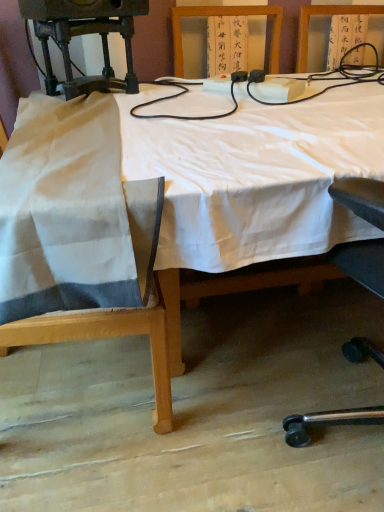
The height and width of the screenshot is (512, 384). Identify the location of white cloth-covered table at center. (252, 182).

What do you see at coordinates (252, 182) in the screenshot? The image size is (384, 512). I see `white cloth-covered table at center` at bounding box center [252, 182].

What do you see at coordinates (117, 309) in the screenshot?
I see `white fabric chair at left` at bounding box center [117, 309].

The image size is (384, 512). What are the coordinates of `white fabric chair at left` in the screenshot? It's located at (117, 309).

Locate an element on the screen. white cloth-covered table at center is located at coordinates (252, 182).

Considering the positions of objects white cloth-covered table at center and white fabric chair at left in the image provided, who is more to the right, white cloth-covered table at center or white fabric chair at left?

white cloth-covered table at center.

Is the depth of white cloth-covered table at center less than that of white fabric chair at left?

Yes, it is in front of white fabric chair at left.

Is point (203, 132) more distant than point (112, 315)?

Yes.

From the image's perspective, is white cloth-covered table at center on top of white fabric chair at left?

Indeed, from the image's perspective, white cloth-covered table at center is shown above white fabric chair at left.

From a real-world perspective, is white cloth-covered table at center over white fabric chair at left?

Actually, white cloth-covered table at center is physically below white fabric chair at left in the real world.

Is white cloth-covered table at center wider or thinner than white fabric chair at left?

Considering their sizes, white cloth-covered table at center looks broader than white fabric chair at left.

From their relative heights in the image, would you say white cloth-covered table at center is taller or shorter than white fabric chair at left?

In the image, white cloth-covered table at center appears to be shorter than white fabric chair at left.

Which of these two, white cloth-covered table at center or white fabric chair at left, is bigger?

With larger size is white cloth-covered table at center.

Is white cloth-covered table at center located outside white fabric chair at left?

Yes, white cloth-covered table at center is not within white fabric chair at left.

Would you say white cloth-covered table at center is a long distance from white fabric chair at left?

No, white cloth-covered table at center is not far from white fabric chair at left.

Is white cloth-covered table at center facing away from white fabric chair at left?

No, white cloth-covered table at center is not facing away from white fabric chair at left.

Looking at this image, can you tell me how much white cloth-covered table at center and white fabric chair at left differ in facing direction?

89.5 degrees.

In the scene shown: How distant is white cloth-covered table at center from white fabric chair at left?

white cloth-covered table at center is 35.29 centimeters from white fabric chair at left.

In order to click on table in front of the white fabric chair at left in this screenshot , I will do `click(252, 182)`.

Considering the relative positions of white fabric chair at left and white cloth-covered table at center in the image provided, is white fabric chair at left to the left of white cloth-covered table at center from the viewer's perspective?

Indeed, white fabric chair at left is positioned on the left side of white cloth-covered table at center.

Which object is further away from the camera taking this photo, white fabric chair at left or white cloth-covered table at center?

white fabric chair at left is more distant.

Is point (106, 322) positioned after point (353, 110)?

That is False.

From the image's perspective, which is below, white fabric chair at left or white cloth-covered table at center?

From the image's view, white fabric chair at left is below.

From a real-world perspective, is white fabric chair at left positioned over white cloth-covered table at center based on gravity?

Yes, from a real-world perspective, white fabric chair at left is above white cloth-covered table at center.

Can you confirm if white fabric chair at left is wider than white cloth-covered table at center?

No, white fabric chair at left is not wider than white cloth-covered table at center.

Considering the sizes of white fabric chair at left and white cloth-covered table at center in the image, is white fabric chair at left taller or shorter than white cloth-covered table at center?

In the image, white fabric chair at left appears to be taller than white cloth-covered table at center.

Can you confirm if white fabric chair at left is bigger than white cloth-covered table at center?

No, white fabric chair at left is not bigger than white cloth-covered table at center.

Looking at this image, would you say white cloth-covered table at center is part of white fabric chair at left's contents?

No, white cloth-covered table at center is not surrounded by white fabric chair at left.

Is white fabric chair at left directly adjacent to white cloth-covered table at center?

No, white fabric chair at left is not making contact with white cloth-covered table at center.

Does white fabric chair at left turn towards white cloth-covered table at center?

Yes, white fabric chair at left faces towards white cloth-covered table at center.

How much distance is there between white fabric chair at left and white cloth-covered table at center?

white fabric chair at left and white cloth-covered table at center are 35.29 centimeters apart from each other.

Where is `chair located on the left of white cloth-covered table at center`? chair located on the left of white cloth-covered table at center is located at coordinates pyautogui.click(x=117, y=309).

In order to click on table directly beneath the white fabric chair at left (from a real-world perspective) in this screenshot , I will do `click(252, 182)`.

There is a white cloth-covered table at center. At what (x,y) coordinates should I click in order to perform the action: click on chair above it (from a real-world perspective). Please return your answer as a coordinate pair (x, y). The width and height of the screenshot is (384, 512). Looking at the image, I should click on [117, 309].